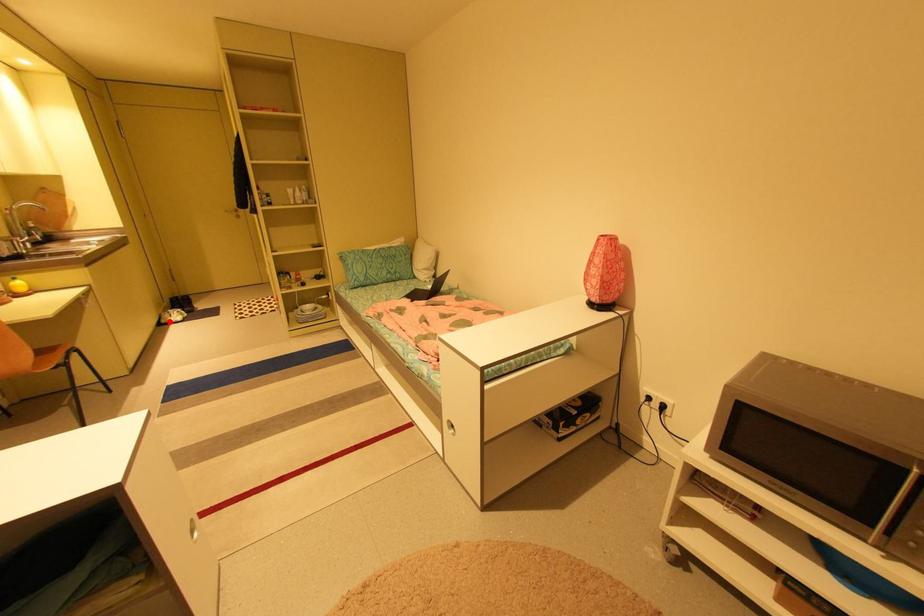
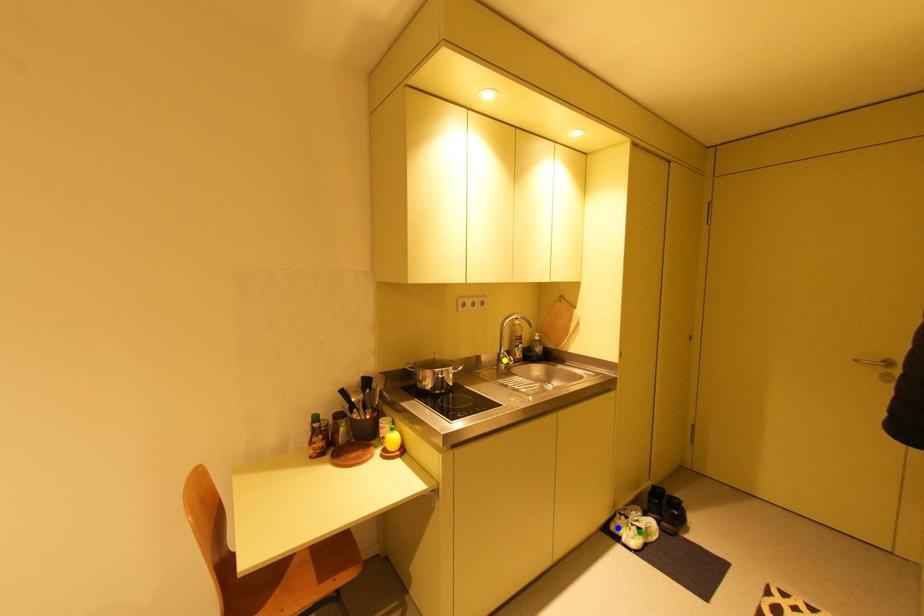
Question: I am providing you with two images of the same scene from different viewpoints. A red point is marked on the first image. You are given multiple points on the second image. Which spot in image 2 lines up with the point in image 1?

Choices:
 (A) blue point
 (B) green point
 (C) yellow point

Answer: (A)